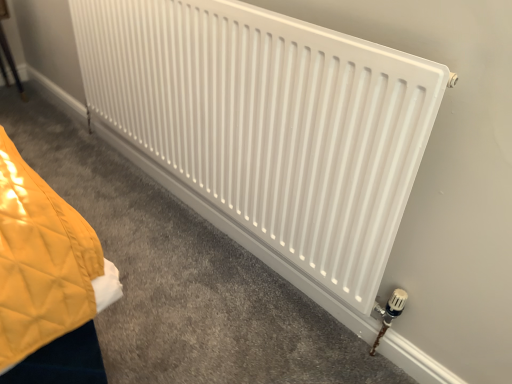
This screenshot has height=384, width=512. What do you see at coordinates (269, 123) in the screenshot?
I see `white matte radiator at center` at bounding box center [269, 123].

You are a GUI agent. You are given a task and a screenshot of the screen. Output one action in this format:
    pyautogui.click(x=<x>, y=<y>)
    Task: Click on the white matte radiator at center
    This screenshot has height=384, width=512.
    Given the screenshot: What is the action you would take?
    pyautogui.click(x=269, y=123)

You are a GUI agent. You are given a task and a screenshot of the screen. Output one action in this format:
    pyautogui.click(x=<x>, y=<y>)
    Task: Click on the white matte radiator at center
    
    Given the screenshot: What is the action you would take?
    pyautogui.click(x=269, y=123)